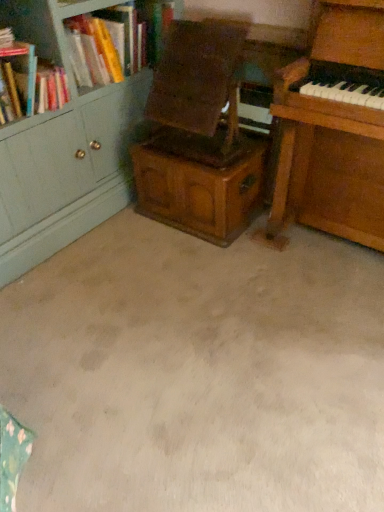
What do you see at coordinates (28, 81) in the screenshot?
I see `hardcover book at upper left` at bounding box center [28, 81].

The height and width of the screenshot is (512, 384). What do you see at coordinates (200, 182) in the screenshot? I see `wooden cabinet at center` at bounding box center [200, 182].

The image size is (384, 512). What do you see at coordinates (198, 373) in the screenshot? I see `beige carpet at center` at bounding box center [198, 373].

Identify the location of wooden bookcase at upper left. The width and height of the screenshot is (384, 512). (48, 26).

From their relative heights in the image, would you say wooden bookcase at upper left is taller or shorter than hardcover book at upper left?

In the image, wooden bookcase at upper left appears to be shorter than hardcover book at upper left.

Is wooden bookcase at upper left in contact with hardcover book at upper left?

wooden bookcase at upper left is not next to hardcover book at upper left, and they're not touching.

Considering the relative sizes of wooden bookcase at upper left and hardcover book at upper left in the image provided, is wooden bookcase at upper left wider than hardcover book at upper left?

No, wooden bookcase at upper left is not wider than hardcover book at upper left.

Is wooden bookcase at upper left in front of or behind hardcover book at upper left in the image?

In the image, wooden bookcase at upper left appears behind hardcover book at upper left.

Who is bigger, hardcover book at upper left or beige carpet at center?

With larger size is beige carpet at center.

In the image, is hardcover book at upper left positioned in front of or behind beige carpet at center?

Clearly, hardcover book at upper left is behind beige carpet at center.

Is beige carpet at center at the back of hardcover book at upper left?

That's not correct — hardcover book at upper left is not looking away from beige carpet at center.

Which object is wider, hardcover book at upper left or beige carpet at center?

beige carpet at center is wider.

Can you confirm if beige carpet at center is bigger than hardcover book at upper left?

Indeed, beige carpet at center has a larger size compared to hardcover book at upper left.

Is beige carpet at center looking in the opposite direction of hardcover book at upper left?

beige carpet at center is not turned away from hardcover book at upper left.

Are beige carpet at center and hardcover book at upper left far apart?

That's not correct — beige carpet at center is a little close to hardcover book at upper left.

Which of these two, beige carpet at center or hardcover book at upper left, stands taller?

With more height is hardcover book at upper left.

Is wooden armchair at center to the left or to the right of wooden bookcase at upper left in the image?

In the image, wooden armchair at center appears on the right side of wooden bookcase at upper left.

Would you say wooden armchair at center is inside or outside wooden bookcase at upper left?

wooden armchair at center cannot be found inside wooden bookcase at upper left.

I want to click on armchair that appears below the wooden bookcase at upper left (from a real-world perspective), so (x=197, y=92).

From the image's perspective, which one is positioned lower, hardcover book at upper left or wooden bookcase at upper left?

hardcover book at upper left.

Locate an element on the screen. book in front of the wooden bookcase at upper left is located at coordinates (28, 81).

Which object is further away from the camera, hardcover book at upper left or wooden bookcase at upper left?

wooden bookcase at upper left is more distant.

In terms of width, does hardcover book at upper left look wider or thinner when compared to wooden bookcase at upper left?

Considering their sizes, hardcover book at upper left looks broader than wooden bookcase at upper left.

In terms of size, does wooden cabinet at center appear bigger or smaller than wooden bookcase at upper left?

In the image, wooden cabinet at center appears to be larger than wooden bookcase at upper left.

Is wooden cabinet at center facing towards wooden bookcase at upper left?

No, wooden cabinet at center does not turn towards wooden bookcase at upper left.

Considering the relative positions of wooden cabinet at center and wooden bookcase at upper left in the image provided, is wooden cabinet at center to the right of wooden bookcase at upper left from the viewer's perspective?

Correct, you'll find wooden cabinet at center to the right of wooden bookcase at upper left.

Is hardcover book at upper left facing towards wooden cabinet at center?

No, hardcover book at upper left is not facing towards wooden cabinet at center.

Is hardcover book at upper left to the left or to the right of wooden cabinet at center in the image?

From the image, it's evident that hardcover book at upper left is to the left of wooden cabinet at center.

Is point (29, 57) positioned behind point (208, 221)?

That is False.

This screenshot has width=384, height=512. Identify the location of book below the wooden bookcase at upper left (from the image's perspective). (28, 81).

Image resolution: width=384 pixels, height=512 pixels. Identify the location of plain that appears below the hardcover book at upper left (from a real-world perspective). (198, 373).

Which object lies further to the anchor point wooden bookcase at upper left, beige carpet at center or hardcover book at upper left?

beige carpet at center.

From the image, which object appears to be farther from wooden armchair at center, wooden bookcase at upper left or wooden piano at right?

wooden bookcase at upper left is further to wooden armchair at center.

When comparing their distances from wooden piano at right, does beige carpet at center or wooden bookcase at upper left seem further?

wooden bookcase at upper left is positioned further to the anchor wooden piano at right.

Looking at the image, which one is located further to wooden bookcase at upper left, wooden armchair at center or beige carpet at center?

beige carpet at center is positioned further to the anchor wooden bookcase at upper left.

Based on the photo, considering their positions, is wooden armchair at center positioned closer to hardcover book at upper left than wooden cabinet at center?

wooden armchair at center is closer to hardcover book at upper left.

Which object lies nearer to the anchor point wooden cabinet at center, wooden bookcase at upper left or hardcover book at upper left?

hardcover book at upper left lies closer to wooden cabinet at center than the other object.

Based on their spatial positions, is wooden piano at right or hardcover book at upper left further from beige carpet at center?

hardcover book at upper left lies further to beige carpet at center than the other object.

Looking at the image, which one is located further to wooden piano at right, beige carpet at center or wooden cabinet at center?

The object further to wooden piano at right is beige carpet at center.

Where is `cabinetry between wooden bookcase at upper left and wooden piano at right in the horizontal direction`? This screenshot has height=512, width=384. cabinetry between wooden bookcase at upper left and wooden piano at right in the horizontal direction is located at coordinates (200, 182).

This screenshot has height=512, width=384. In order to click on bookcase between hardcover book at upper left and wooden cabinet at center from left to right in this screenshot , I will do `click(48, 26)`.

The width and height of the screenshot is (384, 512). In order to click on armchair between wooden bookcase at upper left and beige carpet at center in the vertical direction in this screenshot , I will do `click(197, 92)`.

This screenshot has height=512, width=384. I want to click on cabinetry between wooden armchair at center and wooden piano at right from left to right, so click(200, 182).